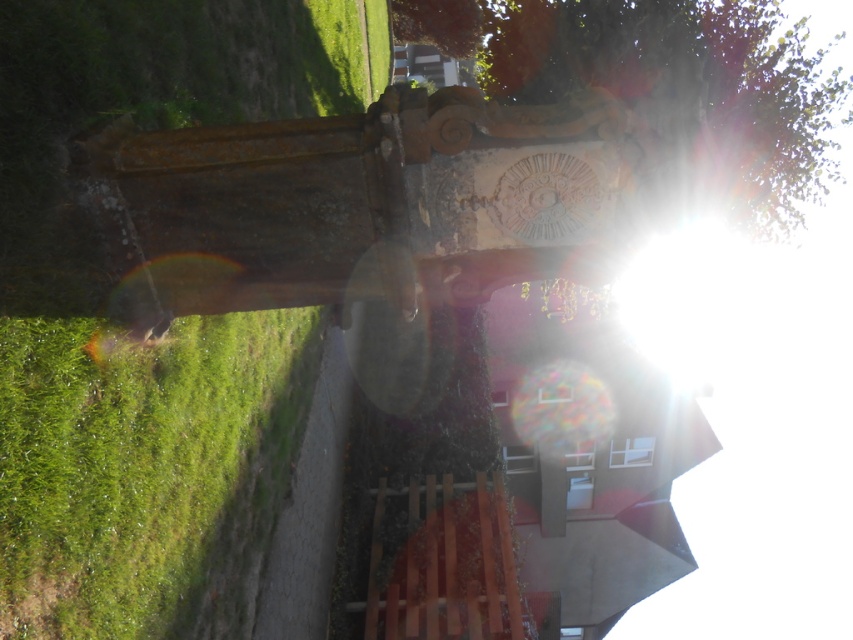
Does green grass at lower left have a greater height compared to green leafy tree at upper center?

No, green grass at lower left is not taller than green leafy tree at upper center.

Can you confirm if green grass at lower left is thinner than green leafy tree at upper center?

Yes, green grass at lower left is thinner than green leafy tree at upper center.

You are a GUI agent. You are given a task and a screenshot of the screen. Output one action in this format:
    pyautogui.click(x=<x>, y=<y>)
    Task: Click on the green grass at lower left
    Image resolution: width=853 pixels, height=640 pixels.
    Given the screenshot: What is the action you would take?
    pyautogui.click(x=144, y=472)

The image size is (853, 640). Find the location of `green grass at lower left`. green grass at lower left is located at coordinates (144, 472).